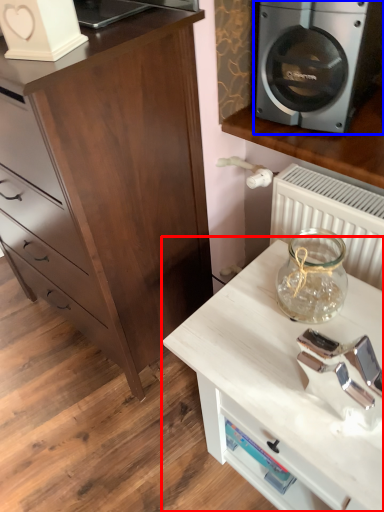
Question: Which object appears closest to the camera in this image, table (highlighted by a red box) or home appliance (highlighted by a blue box)?

Choices:
 (A) table
 (B) home appliance

Answer: (A)